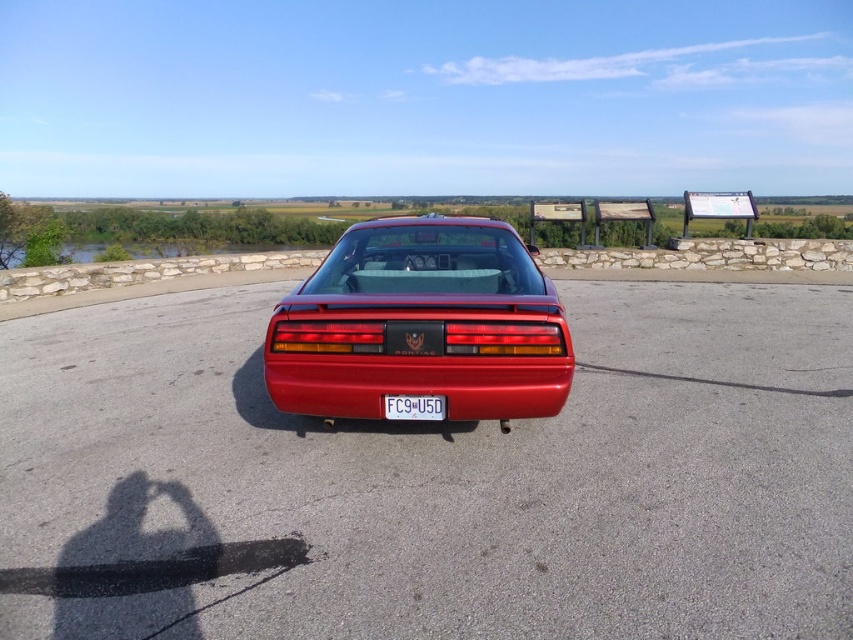
You are standing at the scenic overlook where the red Pontiac sports car is parked. There are two points marked on the ground in front of you. The first point is at coordinates point (267, 326) and the second is at point (363, 369). Which point is closer to you?

Point (267, 326) is closer to you because it is further to the viewer than point (363, 369).

You are a photographer wanting to capture the glossy red bumper at center and the white plastic license plate at center in a single shot. Since you want both objects to be clearly visible, does the height difference between them matter for your composition?

The glossy red bumper at center is taller than the white plastic license plate at center, so the height difference may affect how both objects appear in the photo. Ensure the camera angle accounts for their vertical positions to capture both clearly.

You are standing at the center of the paved area and want to take a photo of the glossy red car at center. Which direction should you face to ensure the car is in the center of your camera frame?

The glossy red car at center is located at point coordinates (421,324), which is very close to the exact center of the paved area. Therefore, facing directly forward while standing at the center should center the car in your camera frame.